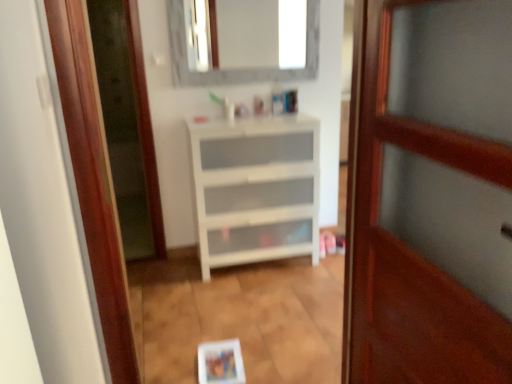
What do you see at coordinates (236, 69) in the screenshot? Image resolution: width=512 pixels, height=384 pixels. I see `white marble mirror at upper center` at bounding box center [236, 69].

Locate an element on the screen. The image size is (512, 384). white marble mirror at upper center is located at coordinates (236, 69).

Find the location of `white matte chest of drawers at center`. white matte chest of drawers at center is located at coordinates (255, 189).

The width and height of the screenshot is (512, 384). In order to click on white marble mirror at upper center in this screenshot , I will do `click(236, 69)`.

Consider the image. Considering the sizes of objects wooden door at center and white marble mirror at upper center in the image provided, who is shorter, wooden door at center or white marble mirror at upper center?

white marble mirror at upper center is shorter.

Is wooden door at center aimed at white marble mirror at upper center?

No, wooden door at center is not turned towards white marble mirror at upper center.

From a real-world perspective, which is physically above, wooden door at center or white marble mirror at upper center?

white marble mirror at upper center.

Does wooden door at center appear on the left side of white marble mirror at upper center?

Incorrect, wooden door at center is not on the left side of white marble mirror at upper center.

Is point (193, 173) positioned before point (404, 124)?

No, (193, 173) is further to viewer.

Looking at this image, which of these two, white matte chest of drawers at center or wooden door at center, is smaller?

With smaller size is wooden door at center.

The width and height of the screenshot is (512, 384). I want to click on chest of drawers to the left of wooden door at center, so click(x=255, y=189).

Which is correct: white matte chest of drawers at center is inside white marble mirror at upper center, or outside of it?

white matte chest of drawers at center is located beyond the bounds of white marble mirror at upper center.

Considering the positions of objects white matte chest of drawers at center and white marble mirror at upper center in the image provided, who is more to the left, white matte chest of drawers at center or white marble mirror at upper center?

white marble mirror at upper center is more to the left.

Is white matte chest of drawers at center bigger than white marble mirror at upper center?

Correct, white matte chest of drawers at center is larger in size than white marble mirror at upper center.

Is white matte chest of drawers at center with white marble mirror at upper center?

No, white matte chest of drawers at center is not touching white marble mirror at upper center.

Is white marble mirror at upper center completely or partially outside of wooden door at center?

That's correct, white marble mirror at upper center is outside of wooden door at center.

From the image's perspective, who appears lower, white marble mirror at upper center or wooden door at center?

From the image's view, wooden door at center is below.

Is white marble mirror at upper center taller or shorter than wooden door at center?

Clearly, white marble mirror at upper center is shorter compared to wooden door at center.

Which object is positioned more to the left, white marble mirror at upper center or wooden door at center?

Positioned to the left is white marble mirror at upper center.

Between wooden door at center and white matte chest of drawers at center, which one has more height?

Standing taller between the two is wooden door at center.

In terms of width, does wooden door at center look wider or thinner when compared to white matte chest of drawers at center?

In the image, wooden door at center appears to be more narrow than white matte chest of drawers at center.

Considering the positions of points (496, 66) and (194, 179), is point (496, 66) closer to camera compared to point (194, 179)?

Yes, point (496, 66) is closer to viewer.

Can you confirm if white marble mirror at upper center is positioned to the right of white matte chest of drawers at center?

Incorrect, white marble mirror at upper center is not on the right side of white matte chest of drawers at center.

Is white matte chest of drawers at center at the back of white marble mirror at upper center?

No.

From the image's perspective, between white marble mirror at upper center and white matte chest of drawers at center, who is located below?

white matte chest of drawers at center, from the image's perspective.

Identify the location of mirror that appears above the wooden door at center (from the image's perspective). Image resolution: width=512 pixels, height=384 pixels. pos(236,69).

Identify the location of door in front of the white matte chest of drawers at center. Image resolution: width=512 pixels, height=384 pixels. (430, 194).

From the image, which object appears to be nearer to white matte chest of drawers at center, white marble mirror at upper center or wooden door at center?

white marble mirror at upper center lies closer to white matte chest of drawers at center than the other object.

Which object lies nearer to the anchor point wooden door at center, white marble mirror at upper center or white matte chest of drawers at center?

white matte chest of drawers at center.

Which object lies further to the anchor point white marble mirror at upper center, white matte chest of drawers at center or wooden door at center?

wooden door at center.

Estimate the real-world distances between objects in this image. Which object is further from wooden door at center, white matte chest of drawers at center or white marble mirror at upper center?

white marble mirror at upper center.

From the image, which object appears to be nearer to white marble mirror at upper center, wooden door at center or white matte chest of drawers at center?

white matte chest of drawers at center is positioned closer to the anchor white marble mirror at upper center.

When comparing their distances from white matte chest of drawers at center, does wooden door at center or white marble mirror at upper center seem further?

wooden door at center.

Where is `the chest of drawers located between wooden door at center and white marble mirror at upper center in the depth direction`? the chest of drawers located between wooden door at center and white marble mirror at upper center in the depth direction is located at coordinates (255, 189).